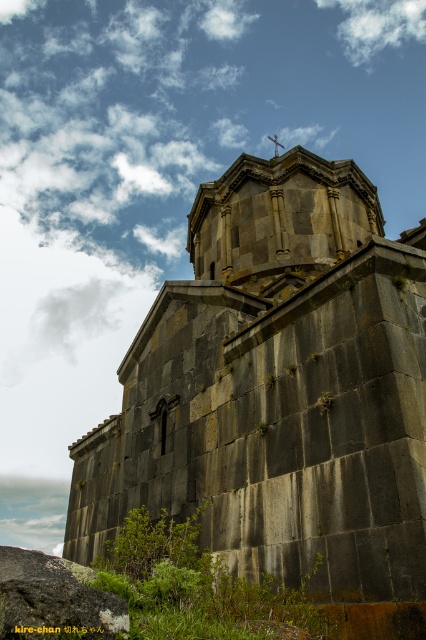
Does point (236, 275) come in front of point (81, 570)?

No, (236, 275) is further to viewer.

Find the location of a particular element. The height and width of the screenshot is (640, 426). dark gray stone tower at upper center is located at coordinates (279, 216).

Does point (275, 243) come behind point (23, 579)?

Yes, point (275, 243) is farther from viewer.

Where is `dark gray stone tower at upper center`? Image resolution: width=426 pixels, height=640 pixels. dark gray stone tower at upper center is located at coordinates (279, 216).

Which of these two, white fluffy cloud at upper center or metallic cross at upper center, stands shorter?

With less height is white fluffy cloud at upper center.

Which is more to the left, white fluffy cloud at upper center or metallic cross at upper center?

From the viewer's perspective, metallic cross at upper center appears more on the left side.

Locate an element on the screen. The height and width of the screenshot is (640, 426). white fluffy cloud at upper center is located at coordinates (377, 24).

Does point (344, 273) come in front of point (37, 588)?

No, it is behind (37, 588).

Where is `dark gray stone church at center`? The width and height of the screenshot is (426, 640). dark gray stone church at center is located at coordinates (279, 396).

The width and height of the screenshot is (426, 640). In order to click on dark gray stone church at center in this screenshot , I will do 279,396.

Where is `dark gray stone church at center`? The height and width of the screenshot is (640, 426). dark gray stone church at center is located at coordinates (279, 396).